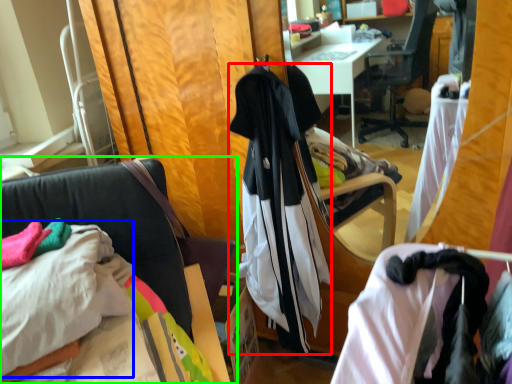
Question: Which object is positioned closest to garment (highlighted by a red box)? Select from sheet (highlighted by a blue box) and chair (highlighted by a green box).

Choices:
 (A) sheet
 (B) chair

Answer: (B)